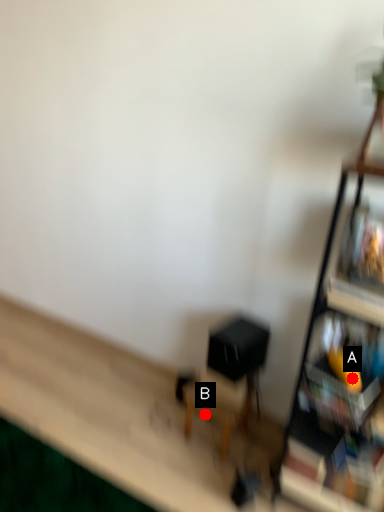
Question: Two points are circled on the image, labeled by A and B beside each circle. Which point is closer to the camera taking this photo?

Choices:
 (A) A is closer
 (B) B is closer

Answer: (A)